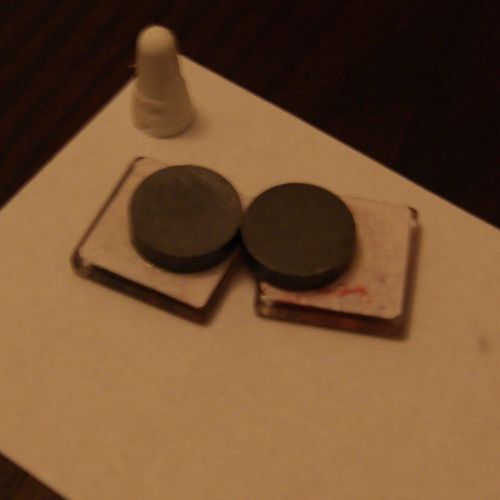
I want to click on square plate, so click(x=105, y=231).